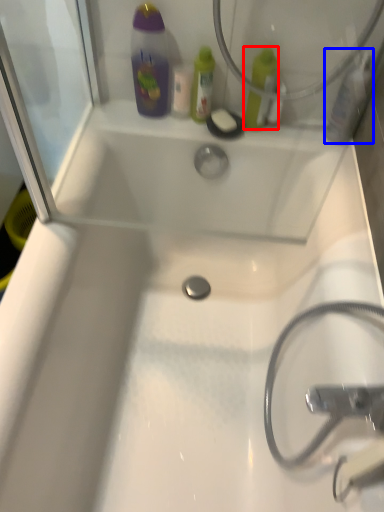
Question: Which point is further to the camera, mouthwash (highlighted by a red box) or mouthwash (highlighted by a blue box)?

Choices:
 (A) mouthwash
 (B) mouthwash

Answer: (A)